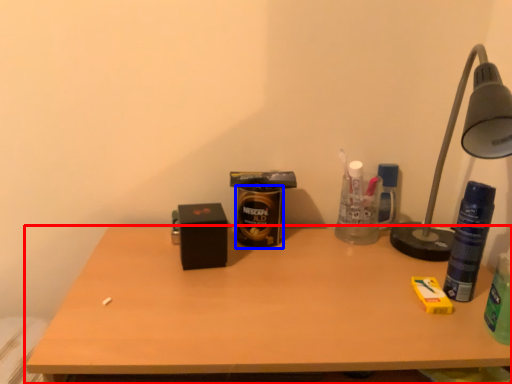
Question: Which point is closer to the camera, desk (highlighted by a red box) or beverage (highlighted by a blue box)?

Choices:
 (A) desk
 (B) beverage

Answer: (A)